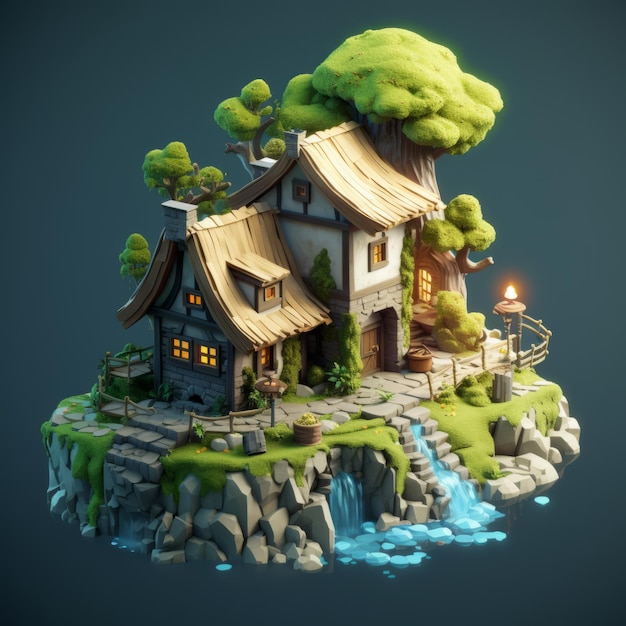
The width and height of the screenshot is (626, 626). Identify the location of door. (377, 334).